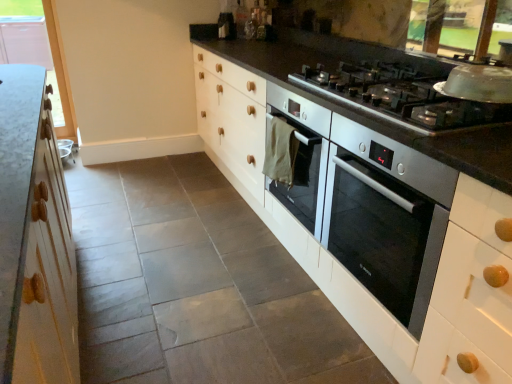
Question: Is clear glass window at upper left at the left side of satin silver gas stove at upper right?

Choices:
 (A) no
 (B) yes

Answer: (B)

Question: From a real-world perspective, is clear glass window at upper left positioned over satin silver gas stove at upper right based on gravity?

Choices:
 (A) no
 (B) yes

Answer: (A)

Question: Does clear glass window at upper left come behind satin silver gas stove at upper right?

Choices:
 (A) yes
 (B) no

Answer: (A)

Question: Is clear glass window at upper left thinner than satin silver gas stove at upper right?

Choices:
 (A) yes
 (B) no

Answer: (A)

Question: Can satin silver gas stove at upper right be found inside clear glass window at upper left?

Choices:
 (A) yes
 (B) no

Answer: (B)

Question: Looking at their shapes, would you say satin silver gas stove at upper right is wider or thinner than satin silver oven at center-right?

Choices:
 (A) wide
 (B) thin

Answer: (B)

Question: From a real-world perspective, is satin silver gas stove at upper right above or below satin silver oven at center-right?

Choices:
 (A) above
 (B) below

Answer: (A)

Question: From their relative heights in the image, would you say satin silver gas stove at upper right is taller or shorter than satin silver oven at center-right?

Choices:
 (A) tall
 (B) short

Answer: (B)

Question: From the image's perspective, is satin silver gas stove at upper right located above or below satin silver oven at center-right?

Choices:
 (A) below
 (B) above

Answer: (B)

Question: Considering the positions of point (414, 286) and point (371, 112), is point (414, 286) closer or farther from the camera than point (371, 112)?

Choices:
 (A) farther
 (B) closer

Answer: (B)

Question: Do you think satin silver oven at center-right is within satin silver gas stove at upper right, or outside of it?

Choices:
 (A) outside
 (B) inside

Answer: (A)

Question: Is satin silver oven at center-right wider or thinner than satin silver gas stove at upper right?

Choices:
 (A) thin
 (B) wide

Answer: (B)

Question: Visually, is satin silver oven at center-right positioned to the left or to the right of satin silver gas stove at upper right?

Choices:
 (A) right
 (B) left

Answer: (A)

Question: Looking at their shapes, would you say satin silver gas stove at upper right is wider or thinner than clear glass window at upper left?

Choices:
 (A) wide
 (B) thin

Answer: (A)

Question: Considering the relative positions of satin silver gas stove at upper right and clear glass window at upper left in the image provided, is satin silver gas stove at upper right to the left or to the right of clear glass window at upper left?

Choices:
 (A) right
 (B) left

Answer: (A)